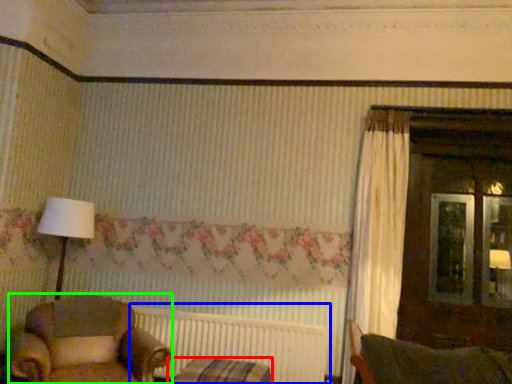
Question: Which is farther away from furniture (highlighted by a red box)? radiator (highlighted by a blue box) or chair (highlighted by a green box)?

Choices:
 (A) radiator
 (B) chair

Answer: (B)